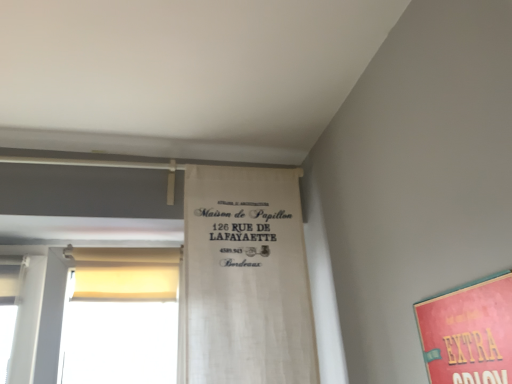
Question: Visually, is white fabric banner at center positioned to the left or to the right of matte pink poster at lower right?

Choices:
 (A) left
 (B) right

Answer: (A)

Question: Is white fabric banner at center spatially inside matte pink poster at lower right, or outside of it?

Choices:
 (A) outside
 (B) inside

Answer: (A)

Question: Is point (306, 360) positioned closer to the camera than point (494, 304)?

Choices:
 (A) farther
 (B) closer

Answer: (A)

Question: Considering their positions, is matte pink poster at lower right located in front of or behind white fabric banner at center?

Choices:
 (A) behind
 (B) front

Answer: (B)

Question: Which is correct: matte pink poster at lower right is inside white fabric banner at center, or outside of it?

Choices:
 (A) inside
 (B) outside

Answer: (B)

Question: Considering the relative positions of matte pink poster at lower right and white fabric banner at center in the image provided, is matte pink poster at lower right to the left or to the right of white fabric banner at center?

Choices:
 (A) right
 (B) left

Answer: (A)

Question: From the image's perspective, is matte pink poster at lower right positioned above or below white fabric banner at center?

Choices:
 (A) below
 (B) above

Answer: (A)